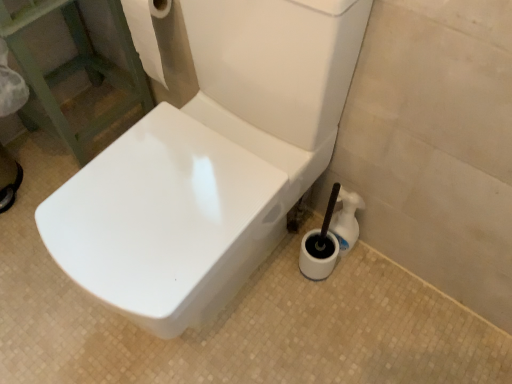
Find the location of `vacant space situated on the left part of white glossy toilet brush at lower right`. vacant space situated on the left part of white glossy toilet brush at lower right is located at coordinates (279, 268).